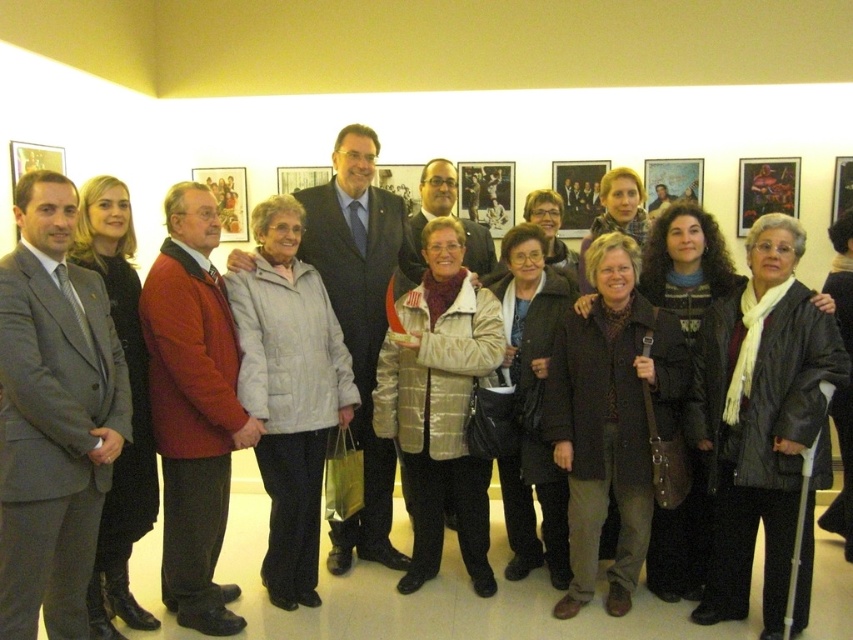
Question: Is the position of gray suit at left more distant than that of white leather jacket at center?

Choices:
 (A) yes
 (B) no

Answer: (B)

Question: Which object is positioned farthest from the red woolen jacket at center?

Choices:
 (A) white leather jacket at center
 (B) gray suit at left

Answer: (A)

Question: Among these points, which one is nearest to the camera?

Choices:
 (A) (312, 276)
 (B) (44, 289)
 (C) (196, 472)
 (D) (749, 352)

Answer: (B)

Question: Which object appears farthest from the camera in this image?

Choices:
 (A) white leather jacket at center
 (B) gray suit at left
 (C) light gray quilted jacket at center

Answer: (C)

Question: Does gray suit at left come in front of light gray quilted jacket at center?

Choices:
 (A) no
 (B) yes

Answer: (B)

Question: Is gray suit at left further to camera compared to white leather jacket at center?

Choices:
 (A) yes
 (B) no

Answer: (B)